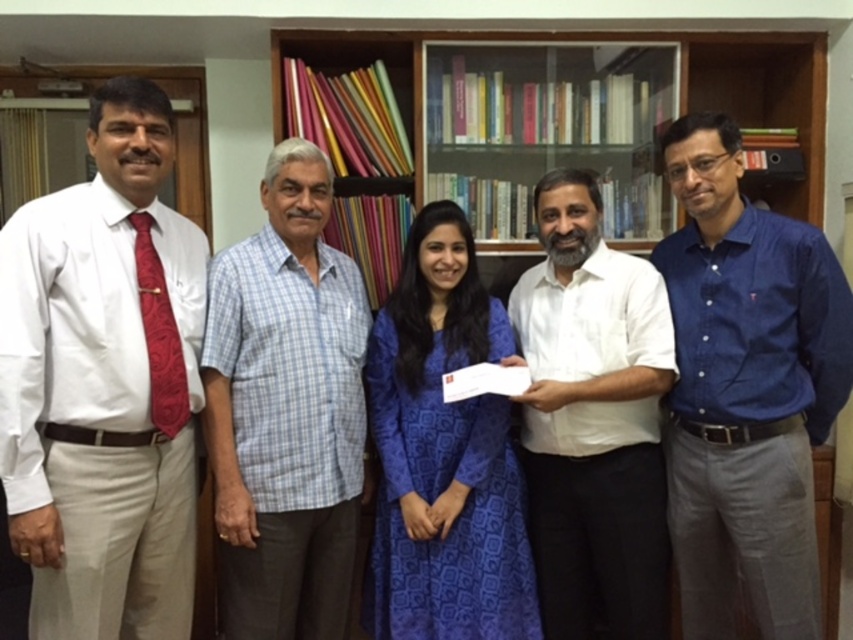
Question: Where is light blue checkered shirt at center located in relation to wooden bookshelf at upper center in the image?

Choices:
 (A) left
 (B) right

Answer: (A)

Question: Which object is farther from the camera taking this photo?

Choices:
 (A) blue printed dress at center
 (B) wooden bookshelf at upper center
 (C) white satin shirt at left

Answer: (B)

Question: Is white cotton shirt at center closer to camera compared to blue printed dress at center?

Choices:
 (A) no
 (B) yes

Answer: (B)

Question: Does blue button-down shirt at center have a larger size compared to light blue checkered shirt at center?

Choices:
 (A) no
 (B) yes

Answer: (B)

Question: Which point is farther to the camera?

Choices:
 (A) (722, 61)
 (B) (775, 628)

Answer: (A)

Question: Which of the following is the closest to the observer?

Choices:
 (A) light blue checkered shirt at center
 (B) wooden bookshelf at upper center

Answer: (A)